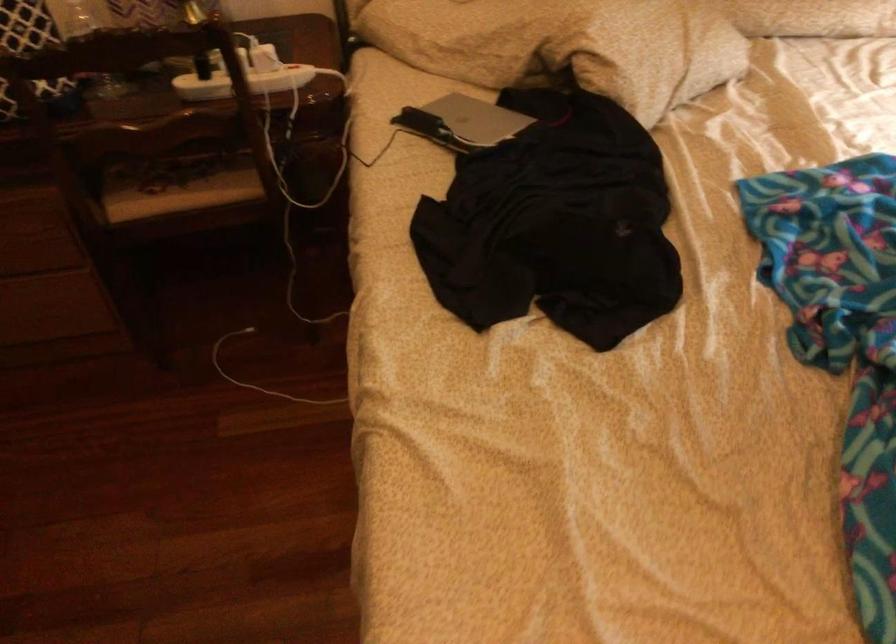
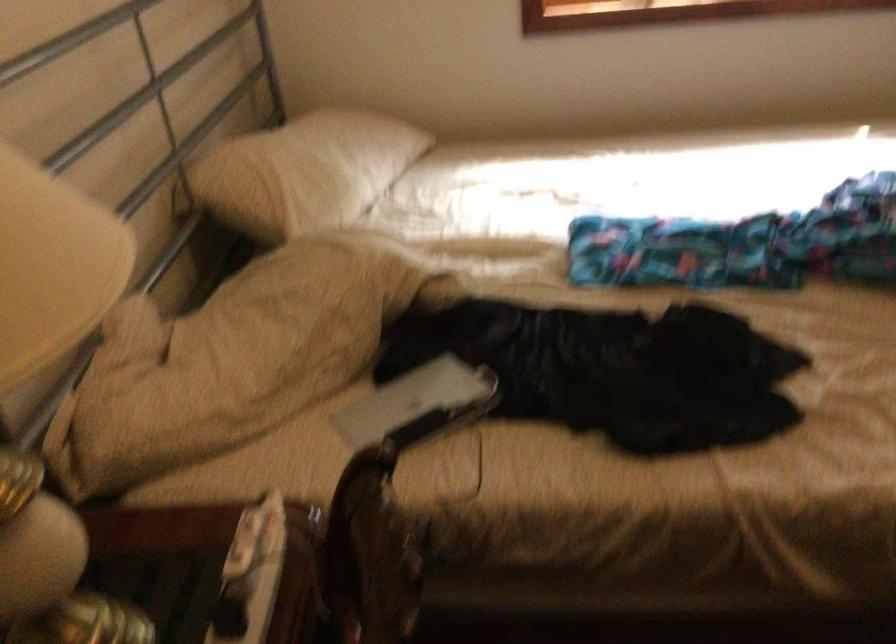
Locate, in the second image, the point that corresponds to point (469, 120) in the first image.

(418, 404)